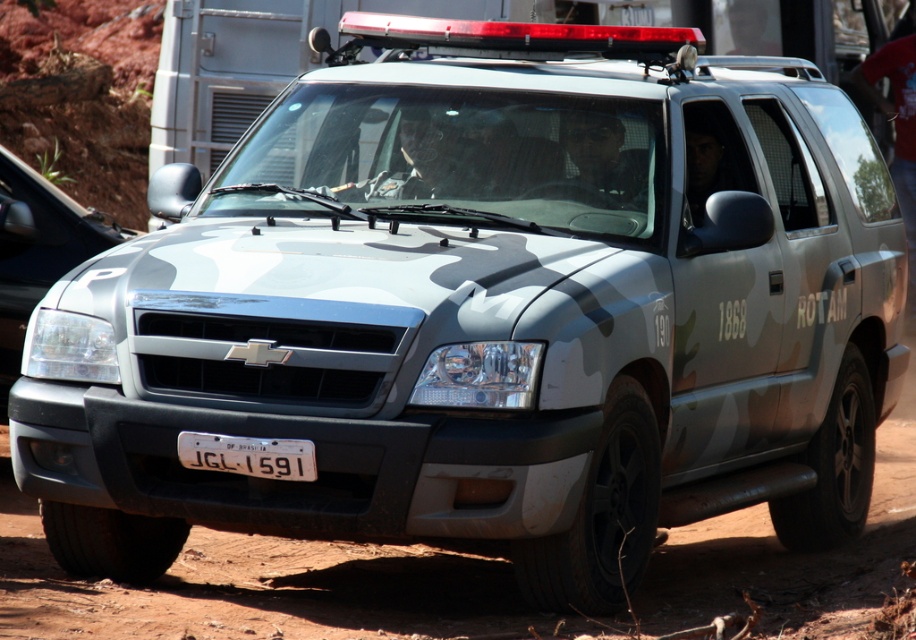
You are a driver approaching the Chevrolet SUV parked on a dirt surface. You need to locate the headlight to ensure safe passage. Where is the point at coordinates (37, 252) located on the vehicle?

The point at coordinates (37, 252) is located on the matte gray headlight at center.

You are a mechanic inspecting a Chevrolet SUV with a camouflage paint scheme. You notice two components at the front of the vehicle. Which component has a greater width between the matte gray headlight at center and the white plastic license plate at center?

The matte gray headlight at center has a greater width than the white plastic license plate at center.